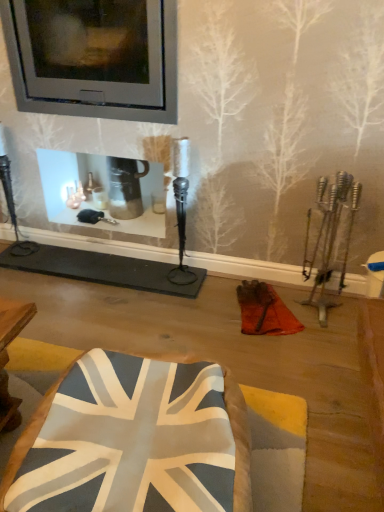
What is the approximate width of metallic glass fireplace at upper center?

metallic glass fireplace at upper center is 13.96 inches wide.

Describe the element at coordinates (94, 59) in the screenshot. This screenshot has width=384, height=512. I see `metallic glass fireplace at upper center` at that location.

Identify the location of metallic glass fireplace at upper center. The height and width of the screenshot is (512, 384). (94, 59).

You are a GUI agent. You are given a task and a screenshot of the screen. Output one action in this format:
    pyautogui.click(x=<x>, y=<y>)
    Task: Click on the fabric union jack cushion at center
    This screenshot has width=384, height=512.
    Given the screenshot: What is the action you would take?
    pyautogui.click(x=239, y=441)

The height and width of the screenshot is (512, 384). What do you see at coordinates (239, 441) in the screenshot? I see `fabric union jack cushion at center` at bounding box center [239, 441].

Measure the distance between fabric union jack cushion at center and camera.

The depth of fabric union jack cushion at center is 29.34 inches.

Find the location of a particular element. The width and height of the screenshot is (384, 512). metallic glass fireplace at upper center is located at coordinates (94, 59).

Is metallic glass fireplace at upper center at the right side of fabric union jack cushion at center?

No, metallic glass fireplace at upper center is not to the right of fabric union jack cushion at center.

Does metallic glass fireplace at upper center lie in front of fabric union jack cushion at center?

No, it is not.

Is point (176, 104) closer to camera compared to point (29, 421)?

No.

Looking at this image, from the image's perspective, is metallic glass fireplace at upper center above or below fabric union jack cushion at center?

metallic glass fireplace at upper center is above fabric union jack cushion at center.

From a real-world perspective, is metallic glass fireplace at upper center positioned under fabric union jack cushion at center based on gravity?

No.

Which object is wider, metallic glass fireplace at upper center or fabric union jack cushion at center?

fabric union jack cushion at center.

Who is taller, metallic glass fireplace at upper center or fabric union jack cushion at center?

metallic glass fireplace at upper center is taller.

Which of these two, metallic glass fireplace at upper center or fabric union jack cushion at center, is bigger?

With larger size is metallic glass fireplace at upper center.

Would you say metallic glass fireplace at upper center is outside fabric union jack cushion at center?

That's correct, metallic glass fireplace at upper center is outside of fabric union jack cushion at center.

Are metallic glass fireplace at upper center and fabric union jack cushion at center making contact?

metallic glass fireplace at upper center is not next to fabric union jack cushion at center, and they're not touching.

Is metallic glass fireplace at upper center positioned with its back to fabric union jack cushion at center?

No.

What's the angular difference between metallic glass fireplace at upper center and fabric union jack cushion at center's facing directions?

The facing directions of metallic glass fireplace at upper center and fabric union jack cushion at center are 79.1 degrees apart.

Where is `picture frame behind the fabric union jack cushion at center`? The image size is (384, 512). picture frame behind the fabric union jack cushion at center is located at coordinates (94, 59).

Considering the positions of objects fabric union jack cushion at center and metallic glass fireplace at upper center in the image provided, who is more to the left, fabric union jack cushion at center or metallic glass fireplace at upper center?

metallic glass fireplace at upper center.

Which object is further away from the camera, fabric union jack cushion at center or metallic glass fireplace at upper center?

metallic glass fireplace at upper center.

Does point (0, 484) come in front of point (7, 17)?

Yes, point (0, 484) is in front of point (7, 17).

From the image's perspective, is fabric union jack cushion at center located above or below metallic glass fireplace at upper center?

fabric union jack cushion at center is below metallic glass fireplace at upper center.

From a real-world perspective, who is located higher, fabric union jack cushion at center or metallic glass fireplace at upper center?

metallic glass fireplace at upper center, from a real-world perspective.

Can you confirm if fabric union jack cushion at center is thinner than metallic glass fireplace at upper center?

No, fabric union jack cushion at center is not thinner than metallic glass fireplace at upper center.

Is fabric union jack cushion at center shorter than metallic glass fireplace at upper center?

Indeed, fabric union jack cushion at center has a lesser height compared to metallic glass fireplace at upper center.

Considering the sizes of objects fabric union jack cushion at center and metallic glass fireplace at upper center in the image provided, who is smaller, fabric union jack cushion at center or metallic glass fireplace at upper center?

Smaller between the two is fabric union jack cushion at center.

Is metallic glass fireplace at upper center located within fabric union jack cushion at center?

Actually, metallic glass fireplace at upper center is outside fabric union jack cushion at center.

Are fabric union jack cushion at center and metallic glass fireplace at upper center far apart?

Yes, fabric union jack cushion at center and metallic glass fireplace at upper center are located far from each other.

Is metallic glass fireplace at upper center at the back of fabric union jack cushion at center?

fabric union jack cushion at center does not have its back to metallic glass fireplace at upper center.

How many degrees apart are the facing directions of fabric union jack cushion at center and metallic glass fireplace at upper center?

79.1 degrees.

Where is `picture frame above the fabric union jack cushion at center (from the image's perspective)`? picture frame above the fabric union jack cushion at center (from the image's perspective) is located at coordinates (94, 59).

Image resolution: width=384 pixels, height=512 pixels. I want to click on furniture located on the right of metallic glass fireplace at upper center, so point(239,441).

Where is `picture frame behind the fabric union jack cushion at center`? The width and height of the screenshot is (384, 512). picture frame behind the fabric union jack cushion at center is located at coordinates (94, 59).